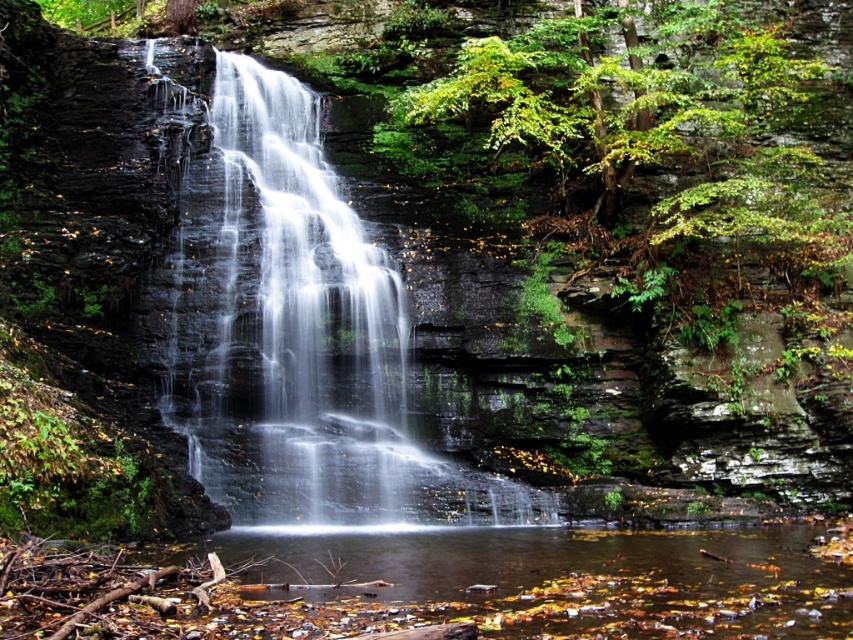
You are standing at the edge of the pool observing the waterfall. Which water feature is closer to you, the translucent white water at center or the clear water at center?

The translucent white water at center is closer to you because the clear water at center is behind it.

You are standing at the edge of the pool and want to throw a stone to hit both the translucent white water at center and the clear water at center. Which one should you aim for first if you want to hit them in the order closest to farthest?

The translucent white water at center is 7.78 meters away from clear water at center. Since you want to hit them in the order closest to farthest, aim for the clear water at center first, then the translucent white water at center.

You are standing at the edge of the pool below the waterfall. You see a point marked at coordinates (299,333). What is located at that point?

The point at coordinates (299,333) marks translucent white water at center.